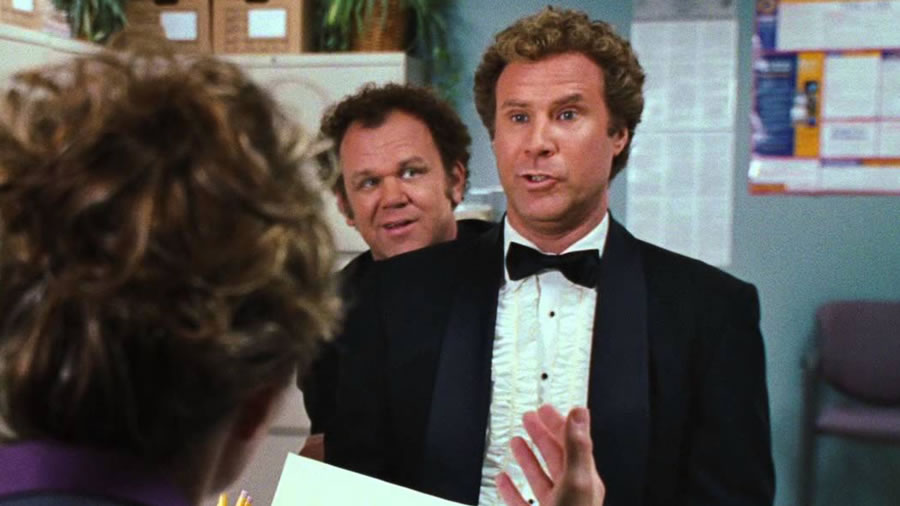
Image resolution: width=900 pixels, height=506 pixels. In order to click on white poster on wall in this screenshot , I will do `click(685, 150)`.